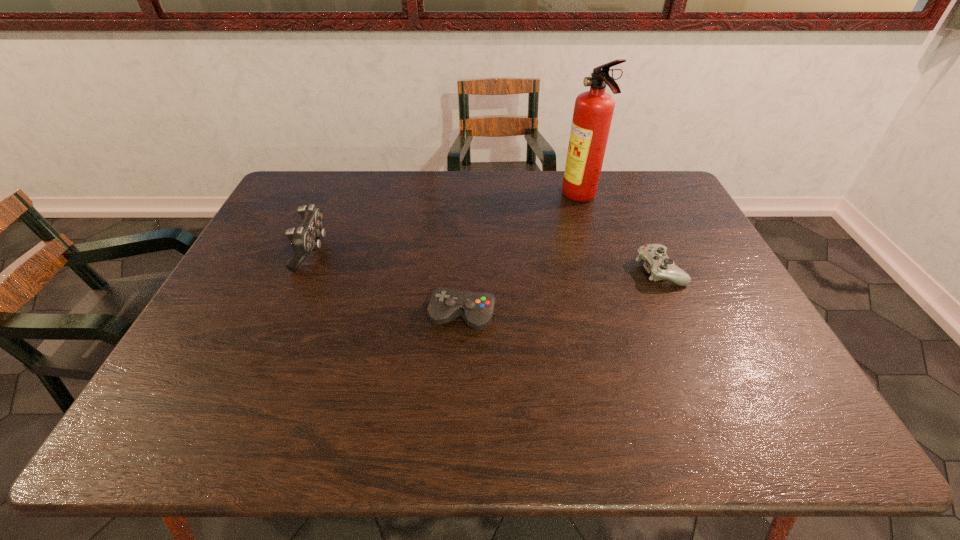
Find the location of a particular element. This screenshot has width=960, height=540. blank space located 0.080m on the surface of the leftmost object with buttons is located at coordinates (354, 251).

Locate an element on the screen. This screenshot has height=540, width=960. free location located 0.120m on the back of the second control from left to right is located at coordinates pyautogui.click(x=464, y=267).

Where is `vacant region located 0.390m on the back of the rightmost control`? The height and width of the screenshot is (540, 960). vacant region located 0.390m on the back of the rightmost control is located at coordinates (620, 182).

Where is `object that is positioned at the far edge`? The width and height of the screenshot is (960, 540). object that is positioned at the far edge is located at coordinates (593, 110).

Locate an element on the screen. The image size is (960, 540). object that is positioned at the left edge is located at coordinates (306, 238).

You are a GUI agent. You are given a task and a screenshot of the screen. Output one action in this format:
    pyautogui.click(x=<x>, y=<y>)
    Task: Click on the object that is at the right edge
    The height and width of the screenshot is (540, 960).
    Given the screenshot: What is the action you would take?
    pyautogui.click(x=656, y=262)

Image resolution: width=960 pixels, height=540 pixels. What are the coordinates of `vacant region at the far edge` in the screenshot? It's located at coord(461,176).

The height and width of the screenshot is (540, 960). I want to click on free location at the near edge of the desktop, so click(x=455, y=419).

This screenshot has width=960, height=540. I want to click on vacant area at the left edge of the desktop, so click(238, 307).

You are a GUI agent. You are given a task and a screenshot of the screen. Output one action in this format:
    pyautogui.click(x=<x>, y=<y>)
    Task: Click on the free space at the far right corner of the desktop
    This screenshot has height=540, width=960.
    Given the screenshot: What is the action you would take?
    pyautogui.click(x=631, y=174)